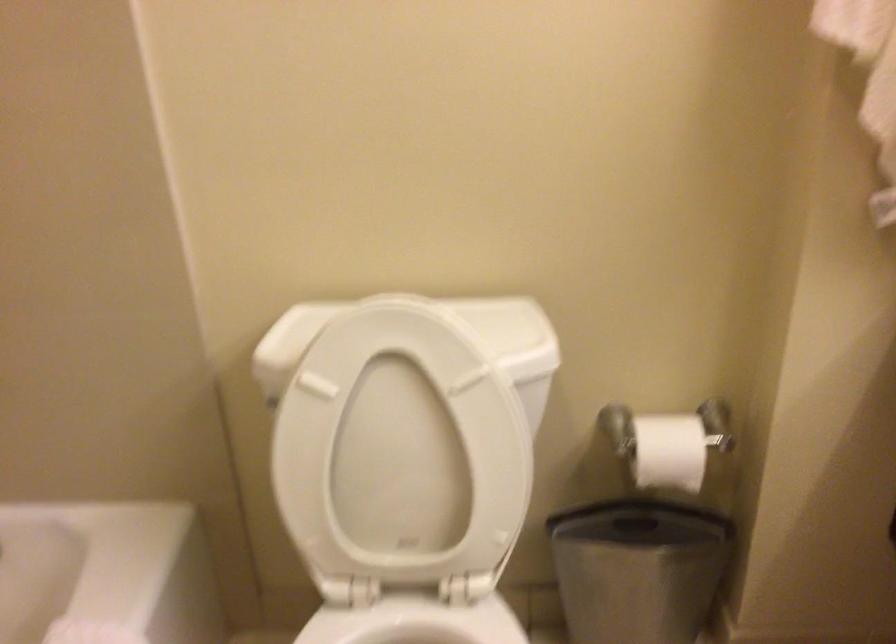
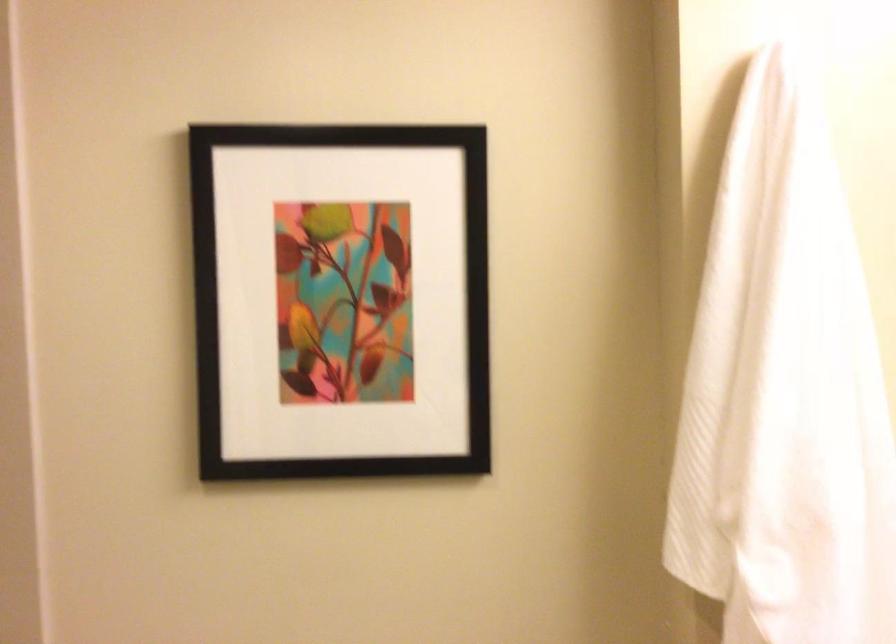
Question: How did the camera likely rotate?

Choices:
 (A) Left
 (B) Right
 (C) Up
 (D) Down

Answer: (C)